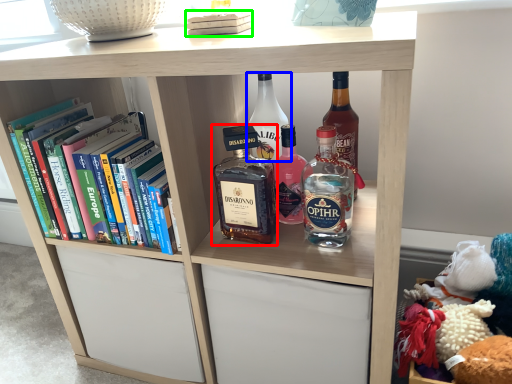
Question: Based on their relative distances, which object is farther from bottle (highlighted by a red box)? Choose from bottle (highlighted by a blue box) and book (highlighted by a green box).

Choices:
 (A) bottle
 (B) book

Answer: (B)